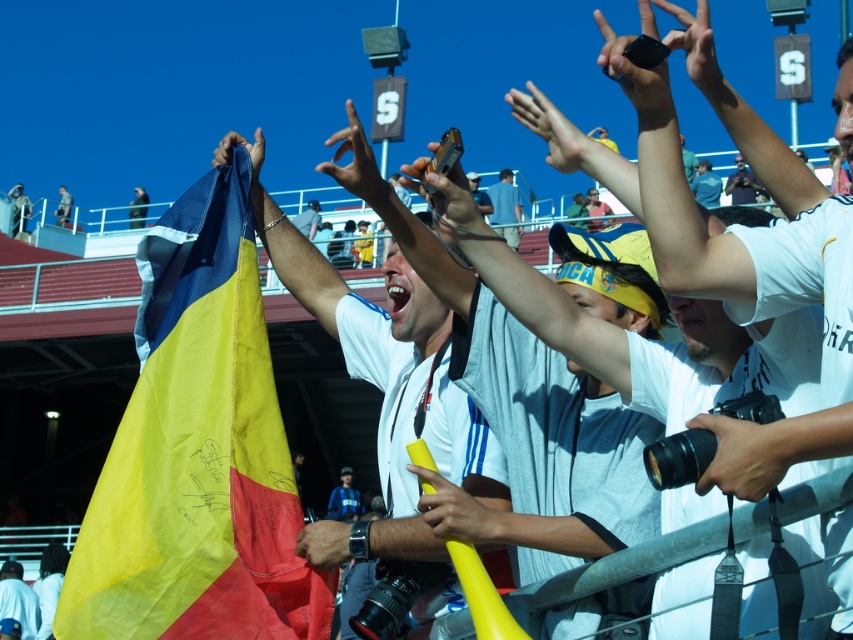
Question: Does yellow rubber baton at center appear on the left side of black matte phone at upper right?

Choices:
 (A) no
 (B) yes

Answer: (B)

Question: Does smooth black camera at center come in front of yellow rubber baton at center?

Choices:
 (A) yes
 (B) no

Answer: (A)

Question: Which object is positioned closest to the smooth black camera at center?

Choices:
 (A) yellow fabric flag at lower left
 (B) matte yellow finger at center
 (C) black matte phone at upper right

Answer: (C)

Question: Can you confirm if white shirt at center is positioned below blue fabric flag at center?

Choices:
 (A) no
 (B) yes

Answer: (A)

Question: Among these objects, which one is nearest to the camera?

Choices:
 (A) black matte phone at upper right
 (B) white shirt at center
 (C) blue fabric flag at upper center
 (D) yellow fabric flag at upper left

Answer: (A)

Question: Among these objects, which one is farthest from the camera?

Choices:
 (A) brown leather wristwatch at center
 (B) yellow rubber baton at center
 (C) black matte phone at upper right

Answer: (A)